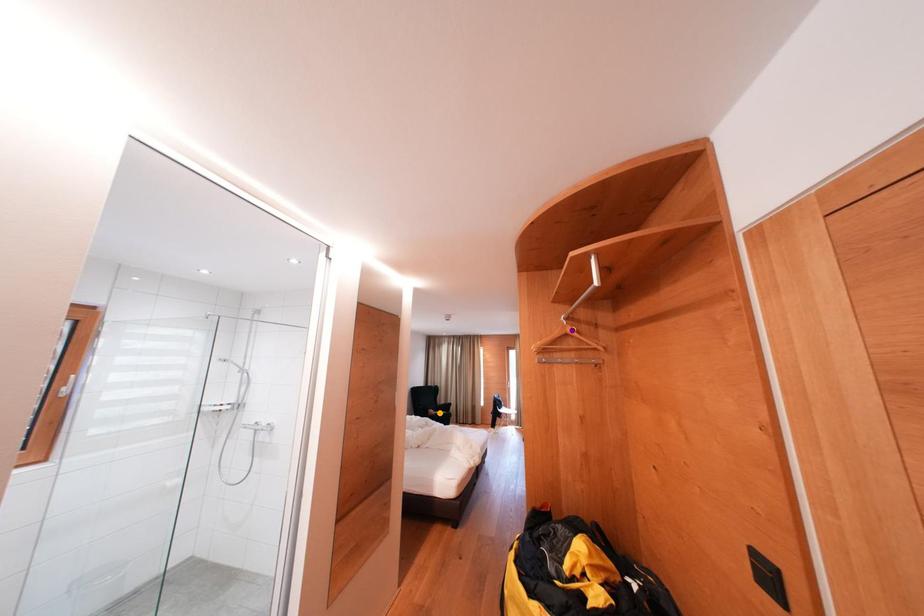
Order these from nearest to farthest:
purple point
orange point
yellow point

yellow point < purple point < orange point